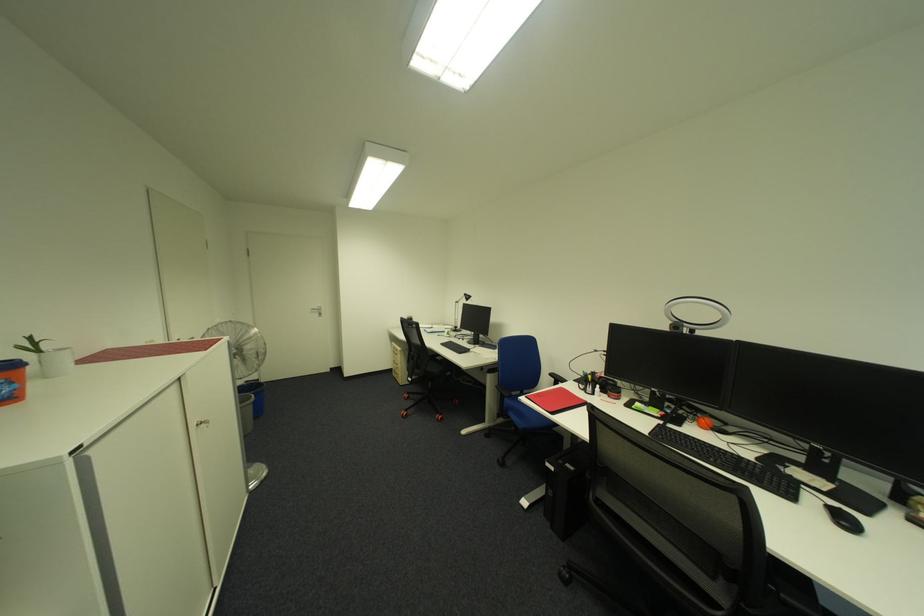
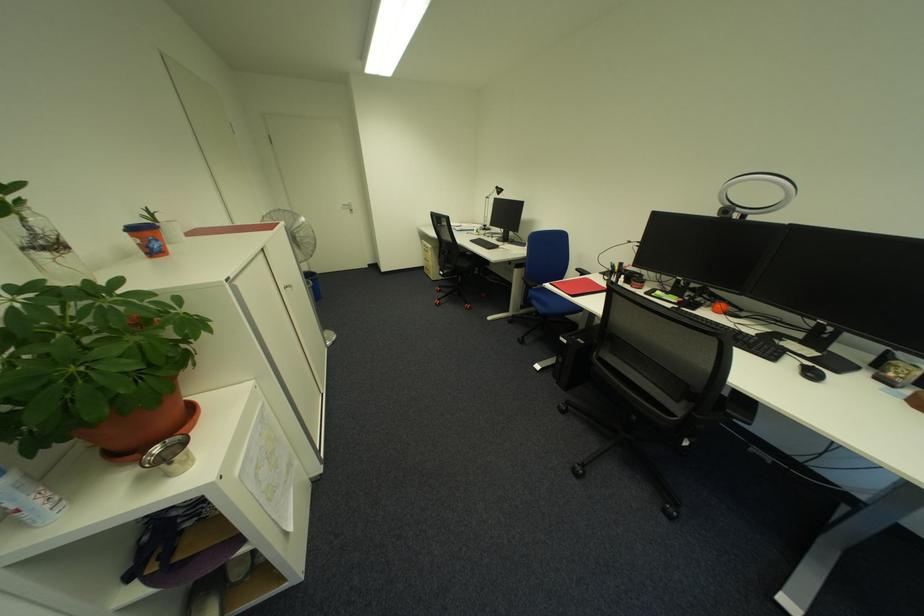
In the second image, find the point that corresponds to (x=704, y=416) in the first image.

(723, 302)